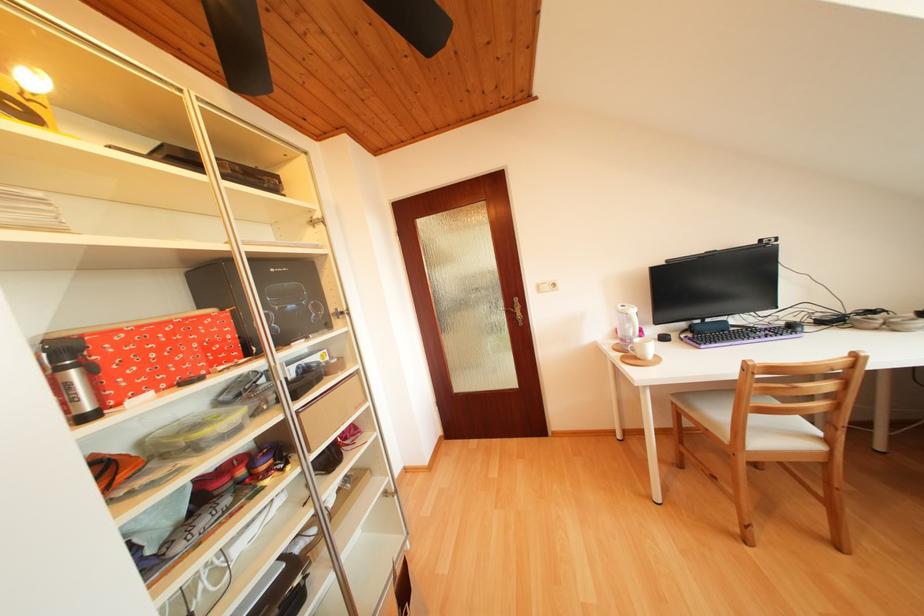
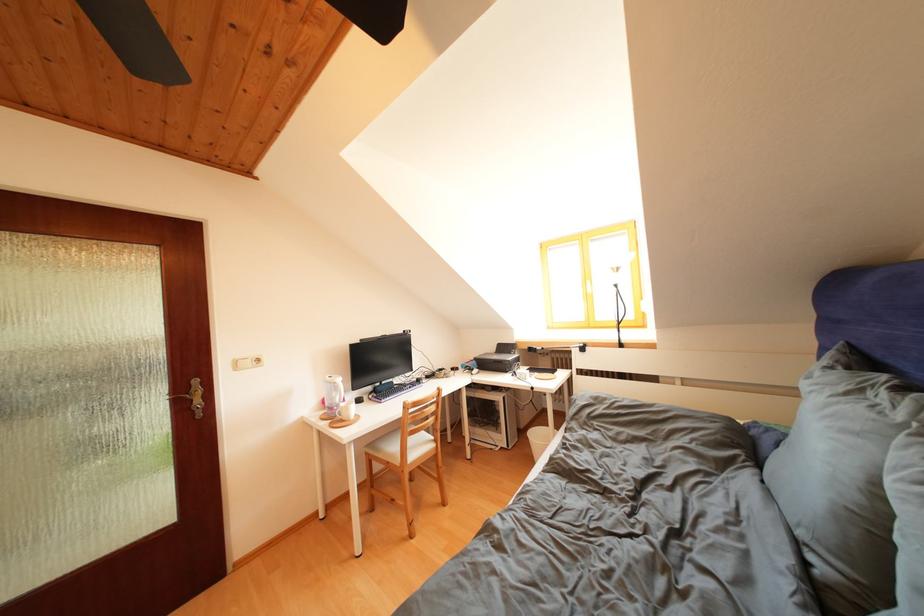
In the second image, find the point that corresponds to the point at 764,424 in the first image.

(419, 446)